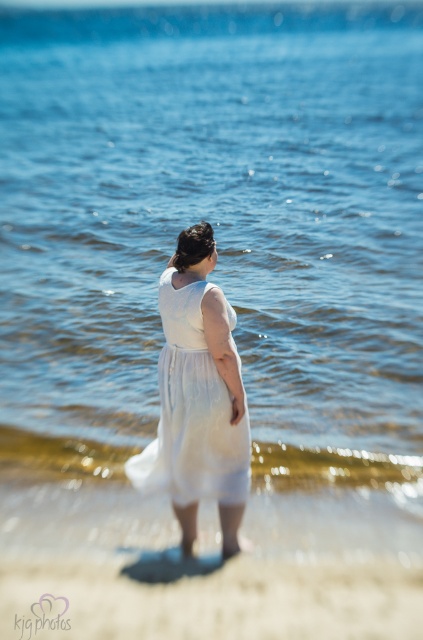
Is white sand at lower center thinner than white sheer dress at center?

No, white sand at lower center is not thinner than white sheer dress at center.

Can you confirm if white sand at lower center is bigger than white sheer dress at center?

No.

Who is more distant from viewer, [85,630] or [211,440]?

Point [211,440]

Where is `white sand at lower center`? The image size is (423, 640). white sand at lower center is located at coordinates (209, 600).